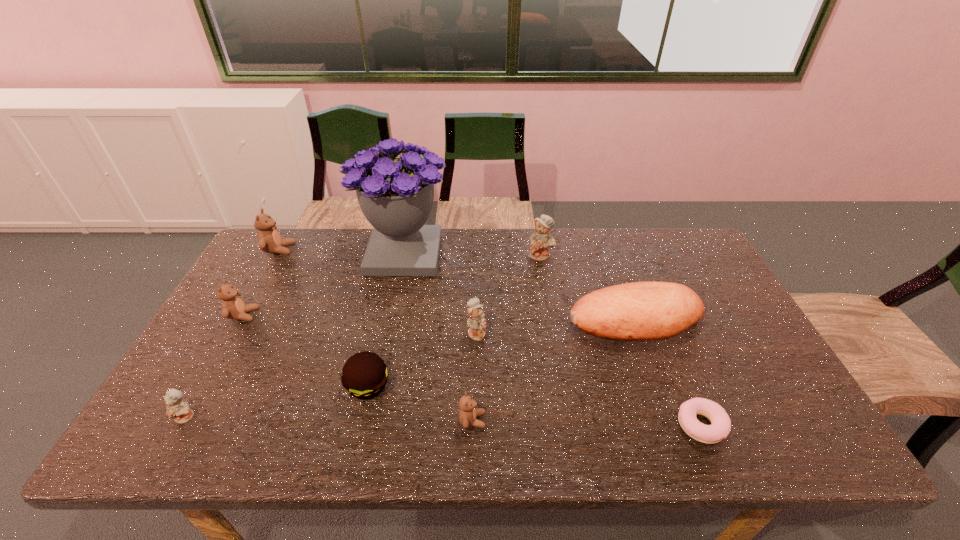
The width and height of the screenshot is (960, 540). In order to click on vacant area at the far edge of the desktop in this screenshot , I will do `click(484, 257)`.

Locate an element on the screen. This screenshot has height=540, width=960. vacant area at the near edge is located at coordinates (504, 420).

Locate an element on the screen. free space at the left edge of the desktop is located at coordinates (212, 335).

Where is `free space at the far left corner of the desktop`? This screenshot has height=540, width=960. free space at the far left corner of the desktop is located at coordinates (265, 256).

Image resolution: width=960 pixels, height=540 pixels. I want to click on unoccupied position between the second biggest blue teddy bear and the smallest brown teddy bear, so click(474, 376).

The height and width of the screenshot is (540, 960). Identify the location of free space between the patty and the leftmost blue teddy bear. (277, 401).

Image resolution: width=960 pixels, height=540 pixels. I want to click on free space between the patty and the purple doughnut, so click(x=535, y=406).

Locate an element on the screen. The image size is (960, 540). free space between the rightmost brown teddy bear and the purple bouquet is located at coordinates (438, 337).

Find the location of a particular element. The height and width of the screenshot is (540, 960). vacant space that is in between the bouquet and the shortest object is located at coordinates (553, 339).

Where is `vacant region between the light bread and the farthest brown teddy bear`? This screenshot has height=540, width=960. vacant region between the light bread and the farthest brown teddy bear is located at coordinates (457, 285).